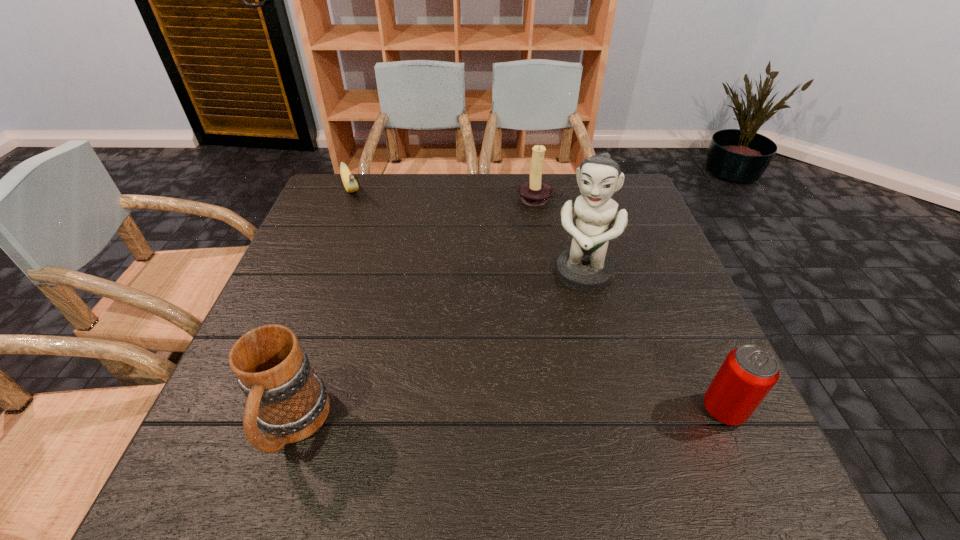
This screenshot has height=540, width=960. Find the location of `mug`. mug is located at coordinates (288, 402).

Where is `can`? This screenshot has width=960, height=540. can is located at coordinates (748, 373).

Find the location of `the rightmost object`. the rightmost object is located at coordinates (748, 373).

I want to click on candle holder, so click(x=534, y=192).

Identify the location of the tallest object. (585, 266).

Where is `the third nearest object`? This screenshot has width=960, height=540. the third nearest object is located at coordinates (585, 266).

Locate an element on the screen. This screenshot has width=960, height=540. banana is located at coordinates (350, 184).

This screenshot has height=540, width=960. I want to click on vacant space located on the back of the rightmost object, so click(x=659, y=266).

Where is `free location located on the wick of the candle holder`? This screenshot has width=960, height=540. free location located on the wick of the candle holder is located at coordinates (524, 246).

I want to click on vacant region located on the wick of the candle holder, so click(529, 228).